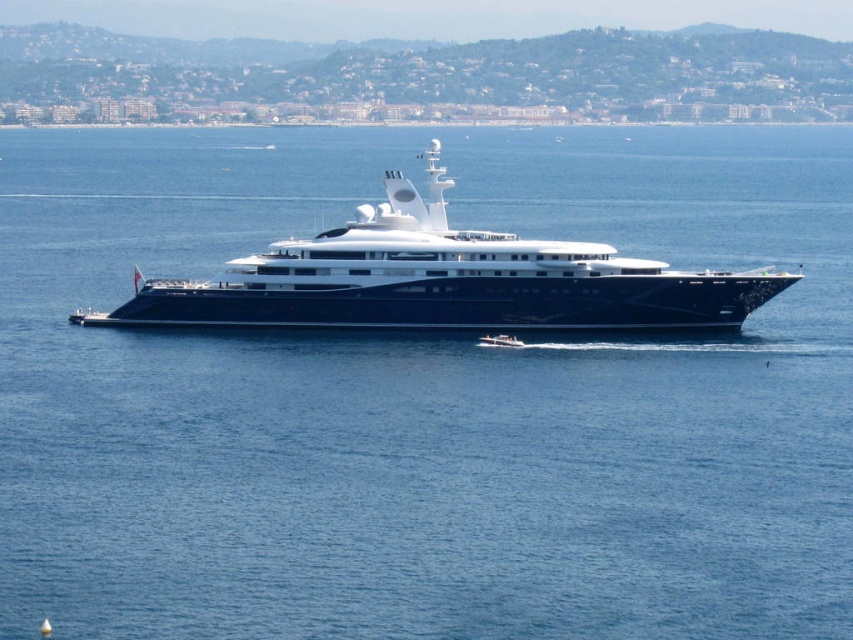
Is point (793, 280) closer to camera compared to point (495, 340)?

That is False.

How much distance is there between white glossy cruise ship at center and white glossy speedboat at center?

white glossy cruise ship at center and white glossy speedboat at center are 8.73 meters apart from each other.

Find the location of a particular element. The height and width of the screenshot is (640, 853). white glossy cruise ship at center is located at coordinates (444, 280).

The height and width of the screenshot is (640, 853). I want to click on white glossy cruise ship at center, so click(x=444, y=280).